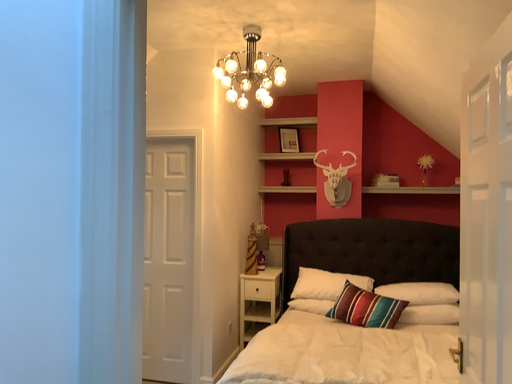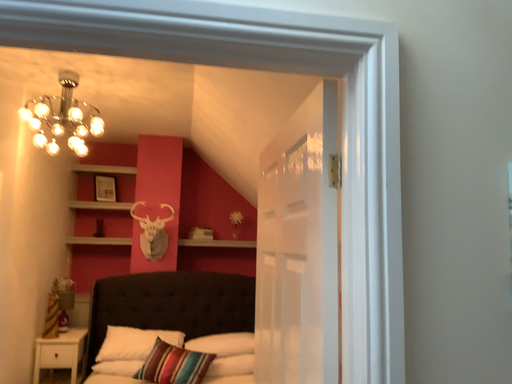
Question: How did the camera likely rotate when shooting the video?

Choices:
 (A) rotated left
 (B) rotated right

Answer: (B)